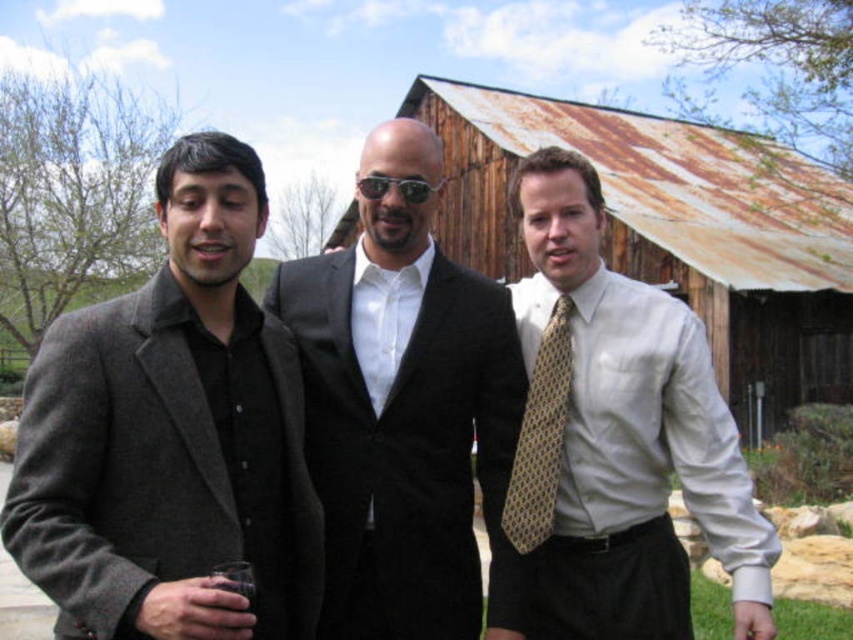
You are a photographer setting up for an outdoor event. You notice the black satin suit at center and the rusty wood hut at center in the frame. Which object would appear narrower when viewed from your current position?

The black satin suit at center appears narrower than the rusty wood hut at center because it is thinner.

You are a photographer trying to capture the white silk shirt at center and the rusty wood hut at center in the same frame. Based on their positions, which object is closer to the camera?

The white silk shirt at center is positioned under the rusty wood hut at center, meaning it is closer to the camera than the hut.

You are standing in front of a rustic wooden structure and want to reach a point that is 17.70 meters away from your current position. The point is marked as point (x=563, y=280). Can you estimate how far you need to walk to reach that point?

The distance between you and point (x=563, y=280) is 17.70 meters, so you need to walk approximately 17.70 meters to reach it.